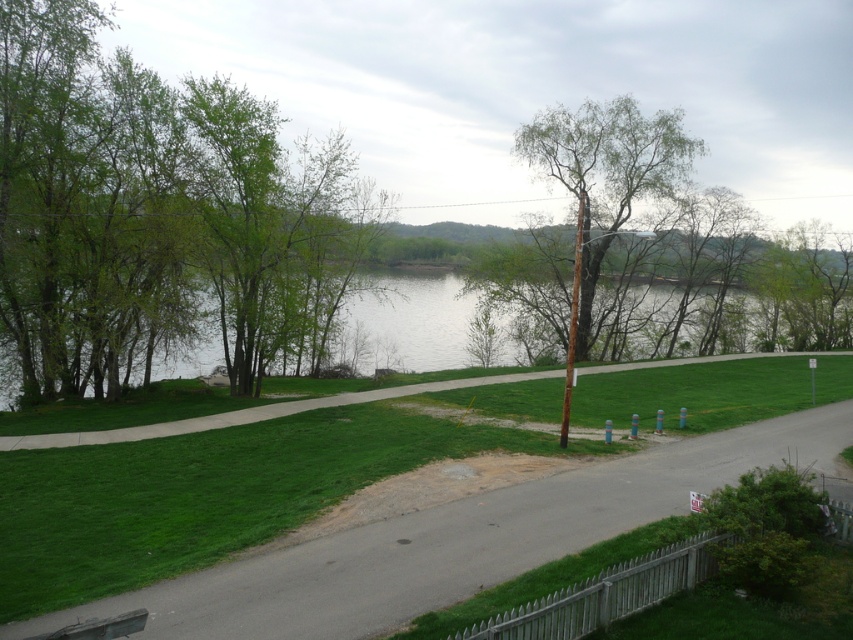
Question: From the image, what is the correct spatial relationship of green leafy tree at center in relation to wooden park bench at lower left?

Choices:
 (A) right
 (B) left

Answer: (A)

Question: Which object appears closest to the camera in this image?

Choices:
 (A) wooden park bench at lower left
 (B) green water at center
 (C) green leafy trees at left
 (D) gray asphalt road at center

Answer: (D)

Question: Which object appears closest to the camera in this image?

Choices:
 (A) gray asphalt road at center
 (B) wooden park bench at lower left
 (C) green water at center
 (D) green leafy trees at left

Answer: (A)

Question: Can you confirm if green leafy trees at left is positioned to the right of green water at center?

Choices:
 (A) yes
 (B) no

Answer: (B)

Question: Among these points, which one is farthest from the camera?

Choices:
 (A) (456, 288)
 (B) (120, 266)
 (C) (508, 492)

Answer: (A)

Question: Does green leafy trees at left have a larger size compared to green water at center?

Choices:
 (A) yes
 (B) no

Answer: (A)